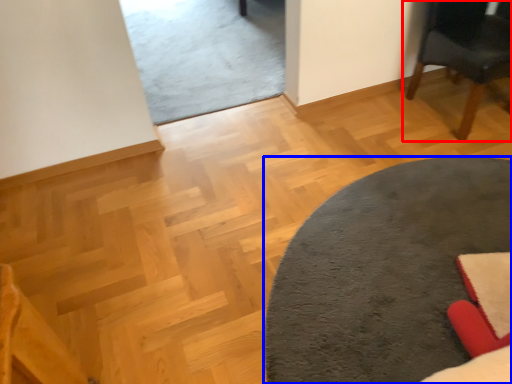
Question: Which point is further to the camera, chair (highlighted by a red box) or table (highlighted by a blue box)?

Choices:
 (A) chair
 (B) table

Answer: (A)